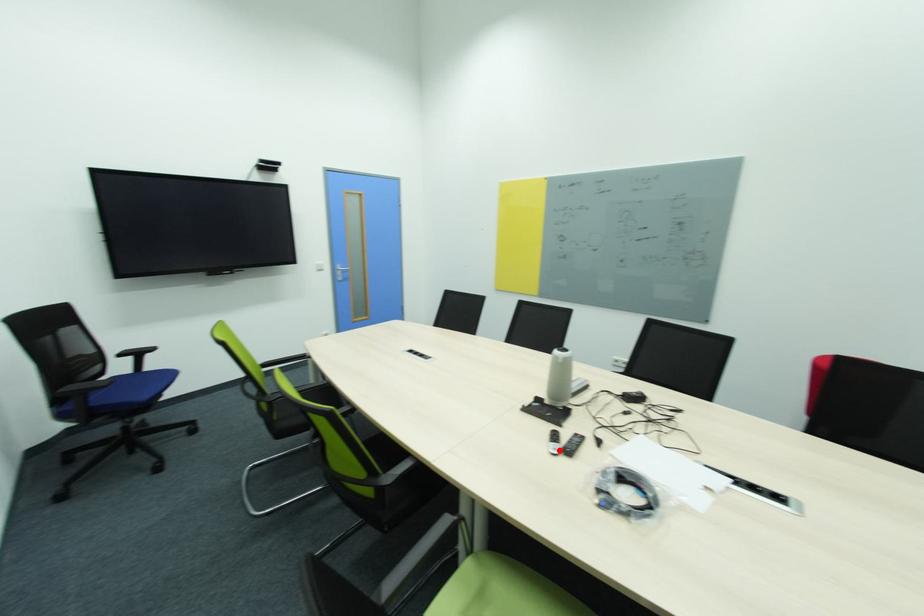
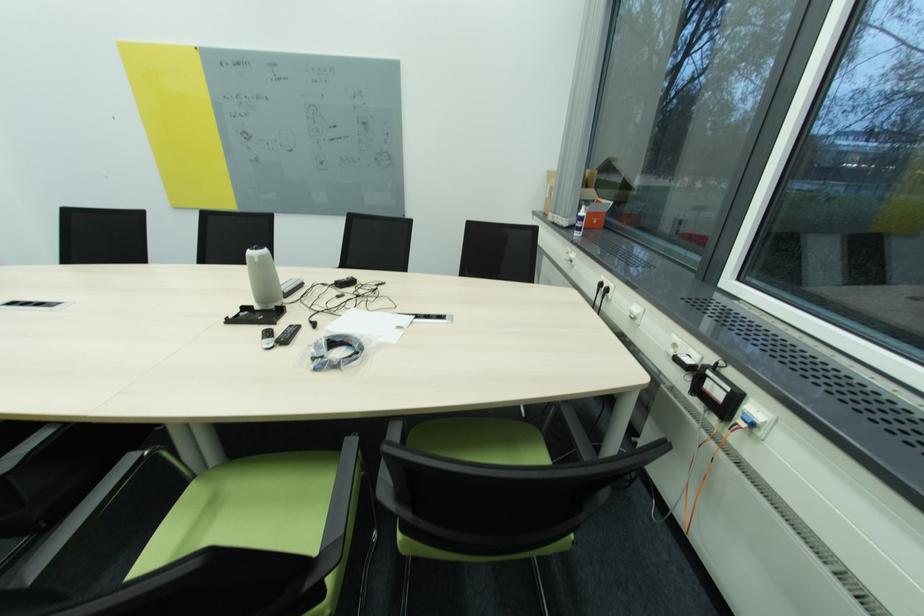
Find the pixel in the second image that matches the highlighted location in the first image.

(273, 345)